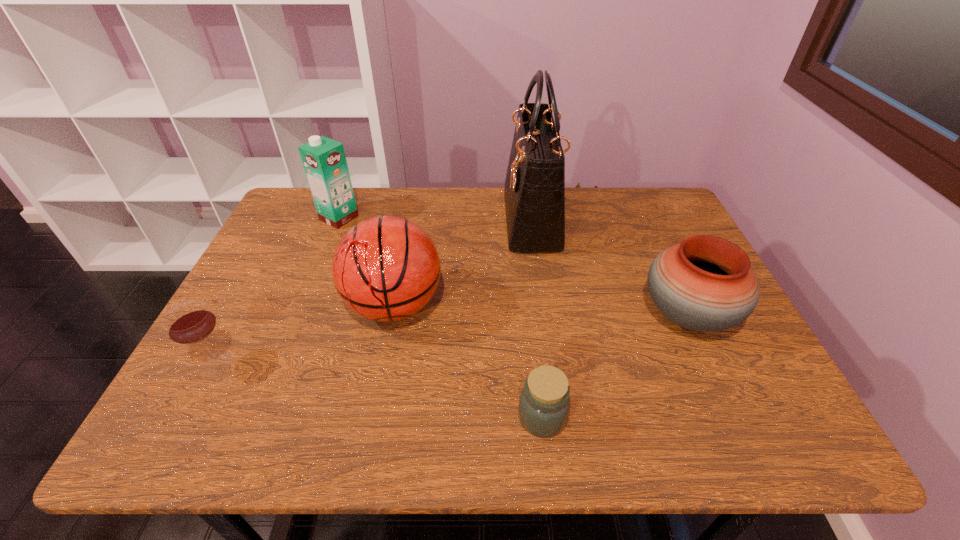
The width and height of the screenshot is (960, 540). What are the coordinates of `handbag` in the screenshot? It's located at (534, 190).

At what (x,y) coordinates should I click in order to perform the action: click on carton. Please return your answer as a coordinate pair (x, y). Looking at the image, I should click on (324, 160).

At what (x,y) coordinates should I click in order to perform the action: click on basketball. Please return your answer as a coordinate pair (x, y). The width and height of the screenshot is (960, 540). Looking at the image, I should click on (386, 268).

In order to click on the rightmost object in this screenshot , I will do `click(705, 283)`.

You are a GUI agent. You are given a task and a screenshot of the screen. Output one action in this format:
    pyautogui.click(x=<x>, y=<y>)
    Task: Click on the pottery
    
    Given the screenshot: What is the action you would take?
    click(705, 283)

Image resolution: width=960 pixels, height=540 pixels. Identify the location of wineglass. (191, 322).

Find the location of a particular element. This screenshot has height=540, width=960. the second shortest object is located at coordinates (191, 322).

Locate an element on the screen. Image resolution: width=960 pixels, height=540 pixels. the nearest object is located at coordinates (544, 405).

Locate an element on the screen. The width and height of the screenshot is (960, 540). jar is located at coordinates (544, 405).

The image size is (960, 540). Identify the location of vacant space located at the front of the handbag with visible charms. (390, 220).